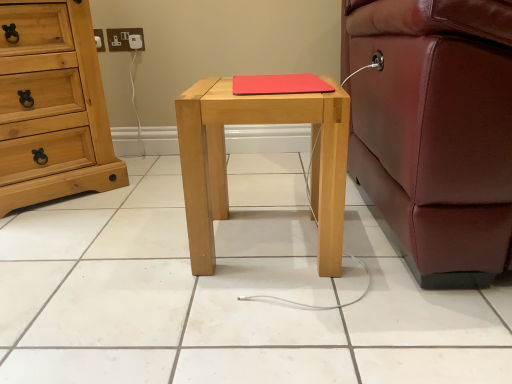
The height and width of the screenshot is (384, 512). I want to click on vacant area that is in front of light wood/texture nightstand at center, so click(274, 321).